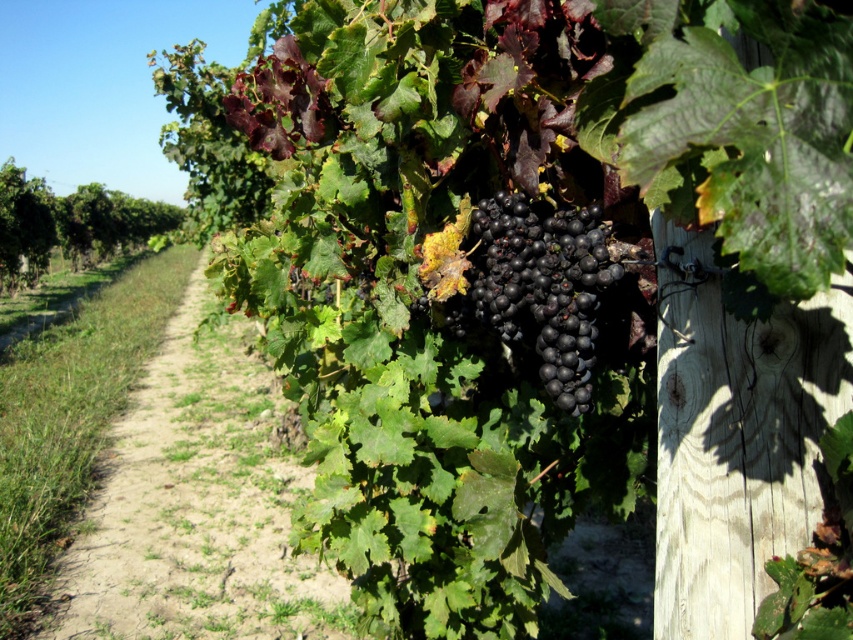
Question: Can you confirm if dirt path at center is wider than shiny black grapes at center?

Choices:
 (A) yes
 (B) no

Answer: (A)

Question: Which point appears farthest from the camera in this image?

Choices:
 (A) (204, 518)
 (B) (492, 220)

Answer: (A)

Question: Which point is closer to the camera taking this photo?

Choices:
 (A) (515, 333)
 (B) (91, 513)

Answer: (A)

Question: Is dirt path at center thinner than shiny black grapes at center?

Choices:
 (A) yes
 (B) no

Answer: (B)

Question: Does dirt path at center come behind shiny black grapes at center?

Choices:
 (A) no
 (B) yes

Answer: (B)